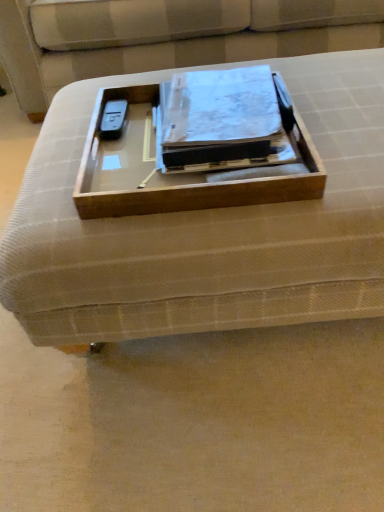
Question: Is wooden tray at center shorter than wooden tray at center?

Choices:
 (A) yes
 (B) no

Answer: (A)

Question: Is wooden tray at center aimed at wooden tray at center?

Choices:
 (A) yes
 (B) no

Answer: (B)

Question: Is wooden tray at center at the right side of wooden tray at center?

Choices:
 (A) yes
 (B) no

Answer: (B)

Question: Considering the relative positions of wooden tray at center and wooden tray at center in the image provided, is wooden tray at center in front of wooden tray at center?

Choices:
 (A) yes
 (B) no

Answer: (B)

Question: Is wooden tray at center wider than wooden tray at center?

Choices:
 (A) yes
 (B) no

Answer: (B)

Question: From the image's perspective, is wooden tray at center below wooden tray at center?

Choices:
 (A) yes
 (B) no

Answer: (B)

Question: Is matte plastic binder at center beside wooden tray at center?

Choices:
 (A) yes
 (B) no

Answer: (A)

Question: Is matte plastic binder at center turned away from wooden tray at center?

Choices:
 (A) no
 (B) yes

Answer: (B)

Question: Is matte plastic binder at center at the left side of wooden tray at center?

Choices:
 (A) yes
 (B) no

Answer: (B)

Question: Is wooden tray at center located within matte plastic binder at center?

Choices:
 (A) yes
 (B) no

Answer: (A)

Question: Is matte plastic binder at center in front of wooden tray at center?

Choices:
 (A) no
 (B) yes

Answer: (A)

Question: Is matte plastic binder at center thinner than wooden tray at center?

Choices:
 (A) no
 (B) yes

Answer: (B)

Question: From a real-world perspective, is beige fabric couch at center physically below matte plastic binder at center?

Choices:
 (A) no
 (B) yes

Answer: (B)